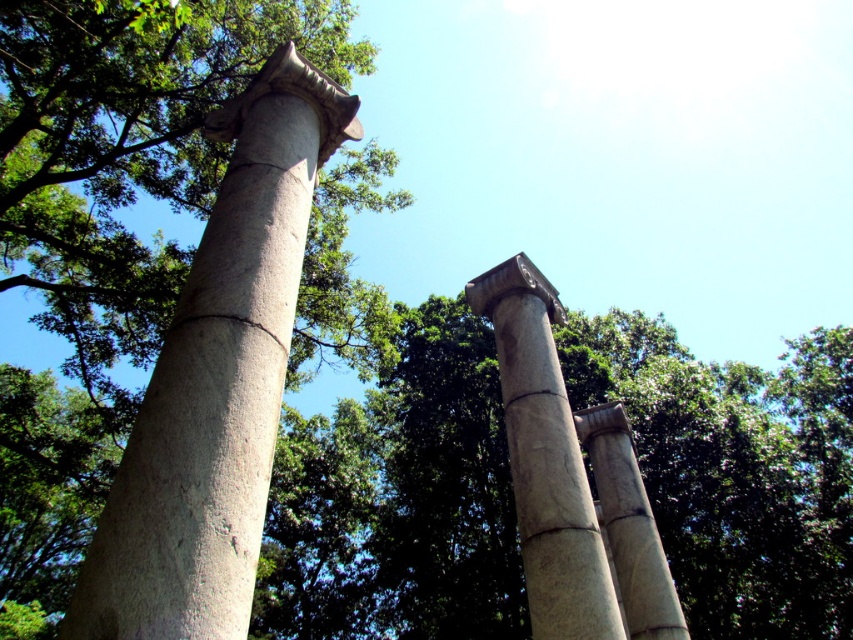
Is point (595, 582) behind point (618, 516)?

No, (595, 582) is closer to viewer.

Can you confirm if white stone column at center is positioned below gray stone column at center?

Incorrect, white stone column at center is not positioned below gray stone column at center.

Where is `white stone column at center`? This screenshot has height=640, width=853. white stone column at center is located at coordinates (544, 460).

How distant is smooth gray column at left from white stone column at center?

The distance of smooth gray column at left from white stone column at center is 1.92 meters.

Who is more forward, (190, 588) or (585, 637)?

Positioned in front is point (190, 588).

What are the coordinates of `smooth gray column at left` in the screenshot? It's located at (216, 381).

Between point (294, 124) and point (624, 628), which one is positioned in front?

Point (294, 124)

Identify the location of smooth gray column at left. (216, 381).